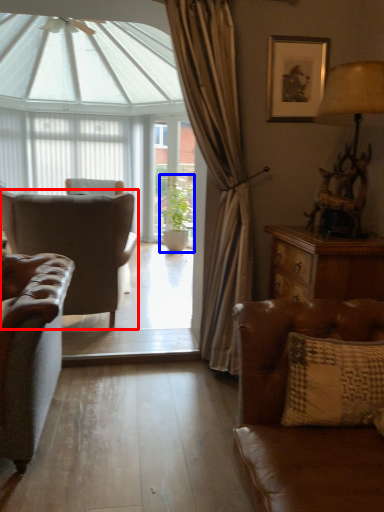
Question: Which object is closer to the camera taking this photo, chair (highlighted by a red box) or houseplant (highlighted by a blue box)?

Choices:
 (A) chair
 (B) houseplant

Answer: (A)